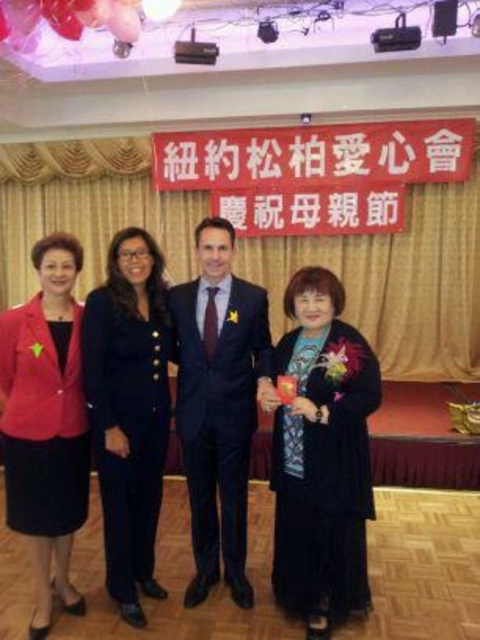
Can you confirm if dark blue suit at center is positioned to the left of matte red blazer at left?

In fact, dark blue suit at center is to the right of matte red blazer at left.

Locate an element on the screen. The height and width of the screenshot is (640, 480). dark blue suit at center is located at coordinates click(129, 410).

Between velvet black dress at center and satin suit at center, which one has more height?

With more height is satin suit at center.

Does velvet black dress at center have a lesser width compared to satin suit at center?

No.

Is point (311, 381) farther from camera compared to point (203, 481)?

No.

You are a GUI agent. You are given a task and a screenshot of the screen. Output one action in this format:
    pyautogui.click(x=<x>, y=<y>)
    Task: Click on the velvet black dress at center
    
    Given the screenshot: What is the action you would take?
    pyautogui.click(x=322, y=458)

What do you see at coordinates (322, 458) in the screenshot? The width and height of the screenshot is (480, 640). I see `velvet black dress at center` at bounding box center [322, 458].

Does velvet black dress at center have a larger size compared to dark blue suit at center?

Yes.

Where is `velvet black dress at center`? This screenshot has height=640, width=480. velvet black dress at center is located at coordinates (322, 458).

Identify the location of velvet black dress at center. (322, 458).